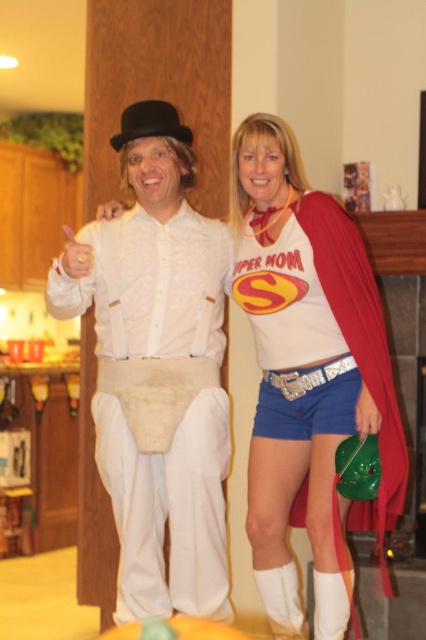
Which is more to the left, white cotton pants at center or matte red cape at center?

white cotton pants at center

Can you confirm if white cotton pants at center is wider than matte red cape at center?

Indeed, white cotton pants at center has a greater width compared to matte red cape at center.

Locate an element on the screen. The image size is (426, 640). white cotton pants at center is located at coordinates (158, 369).